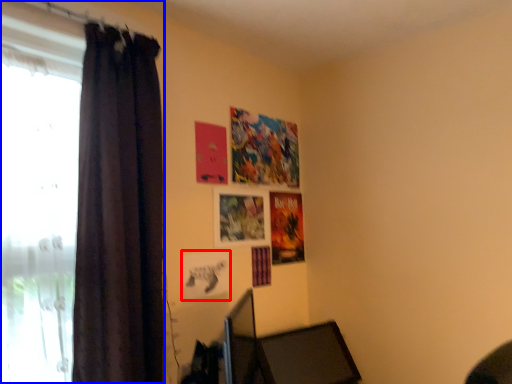
Question: Which point is further to the camera, picture frame (highlighted by a red box) or curtain (highlighted by a blue box)?

Choices:
 (A) picture frame
 (B) curtain

Answer: (A)